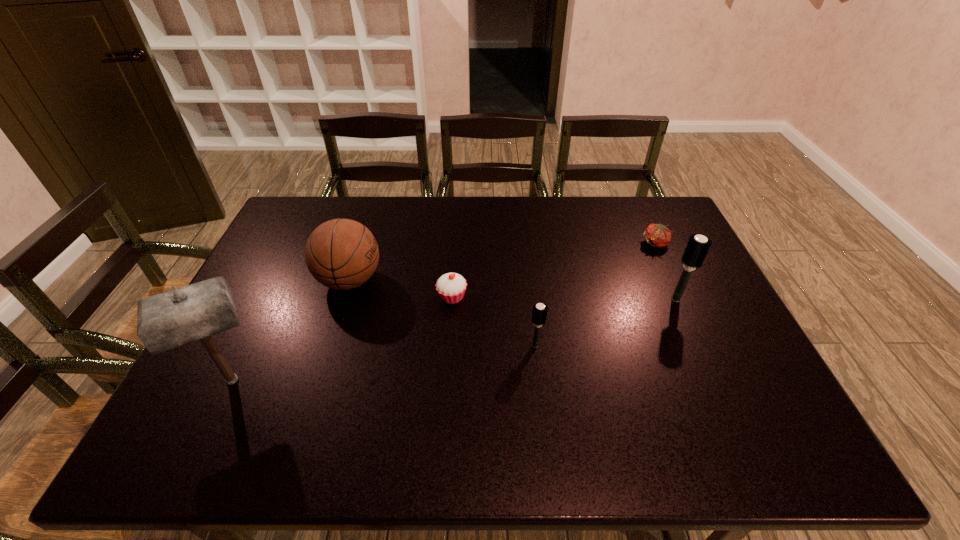
You are a GUI agent. You are given a task and a screenshot of the screen. Output one action in this format:
    pyautogui.click(x=<x>, y=<y>)
    Task: Click on the vacant space at the far right corner
    Image resolution: width=960 pixels, height=540 pixels.
    Given the screenshot: What is the action you would take?
    pyautogui.click(x=641, y=214)

Locate an element on the screen. The height and width of the screenshot is (540, 960). vacant space that is in between the leftmost object and the taller hairbrush is located at coordinates (454, 340).

Where is `free space that is in between the nearer hairbrush and the second shortest object`? Image resolution: width=960 pixels, height=540 pixels. free space that is in between the nearer hairbrush and the second shortest object is located at coordinates (493, 321).

Find the location of `blank region between the right hairbrush and the tomato`. blank region between the right hairbrush and the tomato is located at coordinates (666, 272).

Find the location of a particular element. The height and width of the screenshot is (540, 960). free space between the shortest object and the mallet is located at coordinates 444,312.

Identify the location of blank region between the third object from right to left and the tallest object. Image resolution: width=960 pixels, height=540 pixels. (384, 363).

This screenshot has height=540, width=960. I want to click on vacant space in between the tallest object and the third object from left to right, so click(342, 339).

Find the location of a particular element. free spot between the fifth object from right to left and the mallet is located at coordinates (291, 330).

What are the coordinates of `vacant space in between the shortest object and the cupcake` in the screenshot? It's located at (554, 271).

This screenshot has height=540, width=960. In order to click on vacant point located between the taller hairbrush and the fifth object from right to left in this screenshot , I will do `click(513, 289)`.